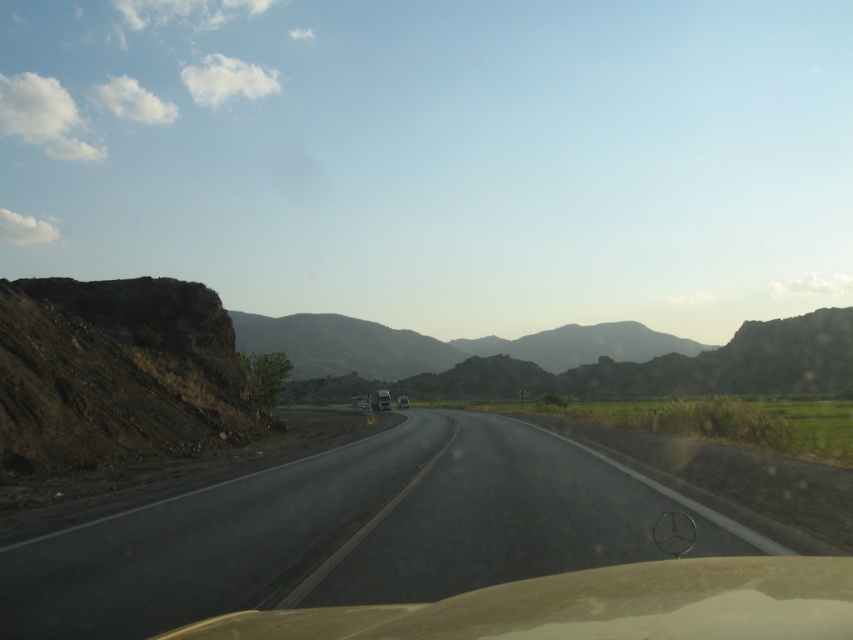
Is asphalt road at center above rugged brown mountain at center?

Incorrect, asphalt road at center is not positioned above rugged brown mountain at center.

Which is in front, point (788, 566) or point (459, 376)?

Point (788, 566) is more forward.

This screenshot has width=853, height=640. Find the location of `asphalt road at center`. asphalt road at center is located at coordinates (421, 552).

Does asphalt road at center appear on the left side of transparent beige car window at center?

Correct, you'll find asphalt road at center to the left of transparent beige car window at center.

How far apart are asphalt road at center and transparent beige car window at center?

2.93 meters

Describe the element at coordinates (421, 552) in the screenshot. I see `asphalt road at center` at that location.

Identify the location of asphalt road at center. This screenshot has height=640, width=853. (421, 552).

Can you confirm if transparent beige car window at center is bigger than rugged brown mountain at center?

No.

Looking at this image, who is lower down, transparent beige car window at center or rugged brown mountain at center?

rugged brown mountain at center is lower down.

I want to click on transparent beige car window at center, so click(x=592, y=605).